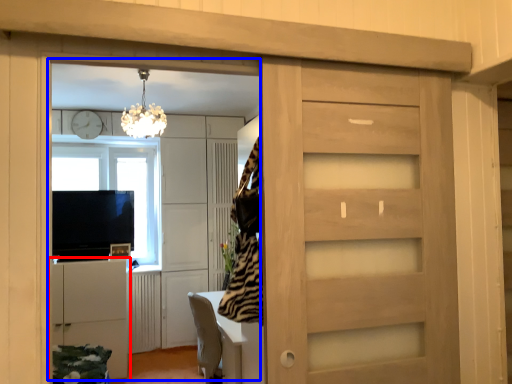
Question: Which of the following is the farthest to the observer, cabinetry (highlighted by a red box) or entertainment center (highlighted by a blue box)?

Choices:
 (A) cabinetry
 (B) entertainment center

Answer: (A)